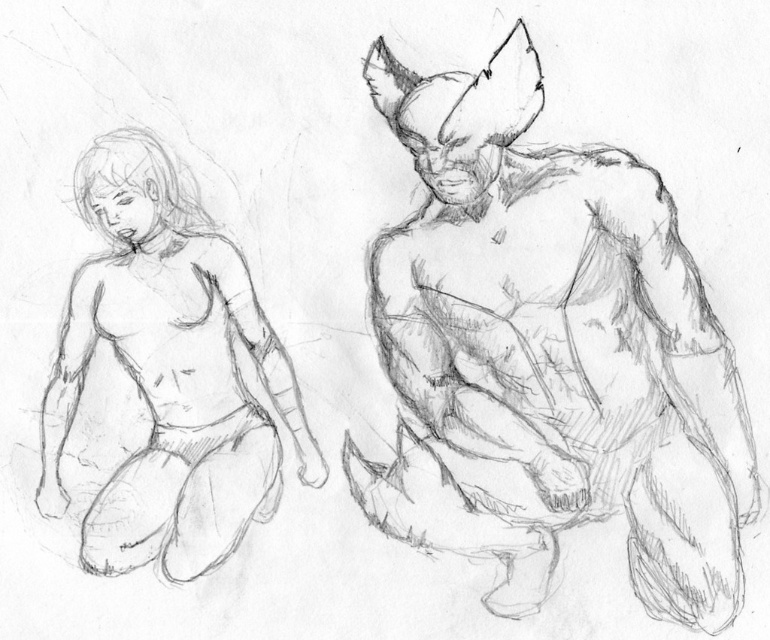
Question: Which point is farther to the camera?

Choices:
 (A) graphite sketch of muscular figure at right
 (B) smooth skin figure at left

Answer: (B)

Question: Where is graphite sketch of muscular figure at right located in relation to smooth skin figure at left in the image?

Choices:
 (A) above
 (B) below

Answer: (B)

Question: Can you confirm if graphite sketch of muscular figure at right is positioned to the left of smooth skin figure at left?

Choices:
 (A) yes
 (B) no

Answer: (B)

Question: Does graphite sketch of muscular figure at right come in front of smooth skin figure at left?

Choices:
 (A) yes
 (B) no

Answer: (A)

Question: Among these objects, which one is nearest to the camera?

Choices:
 (A) smooth skin figure at left
 (B) graphite sketch of muscular figure at right

Answer: (B)